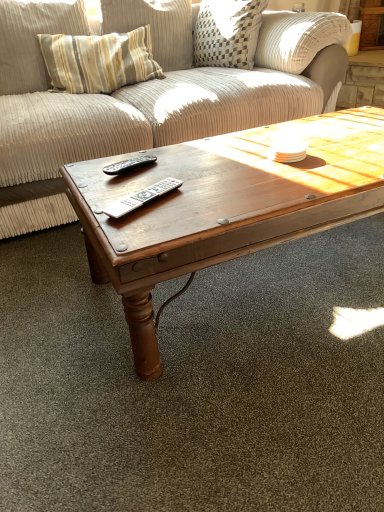
Question: From a real-world perspective, is black plastic remote at center, placed as the second remote when sorted from bottom to top, physically located above or below striped fabric pillow at upper left?

Choices:
 (A) below
 (B) above

Answer: (A)

Question: Considering the positions of point (142, 163) and point (59, 6), is point (142, 163) closer or farther from the camera than point (59, 6)?

Choices:
 (A) farther
 (B) closer

Answer: (B)

Question: Which is nearer to the wooden coffee table at center?

Choices:
 (A) black plastic remote at center, placed as the second remote when sorted from bottom to top
 (B) striped fabric pillow at upper left
 (C) silver metallic remote at center, marked as the second remote in a top-to-bottom arrangement

Answer: (C)

Question: Which object is the farthest from the striped fabric pillow at upper left?

Choices:
 (A) black plastic remote at center, which ranks as the 1th remote in top-to-bottom order
 (B) wooden coffee table at center
 (C) silver metallic remote at center, the first remote positioned from the bottom

Answer: (C)